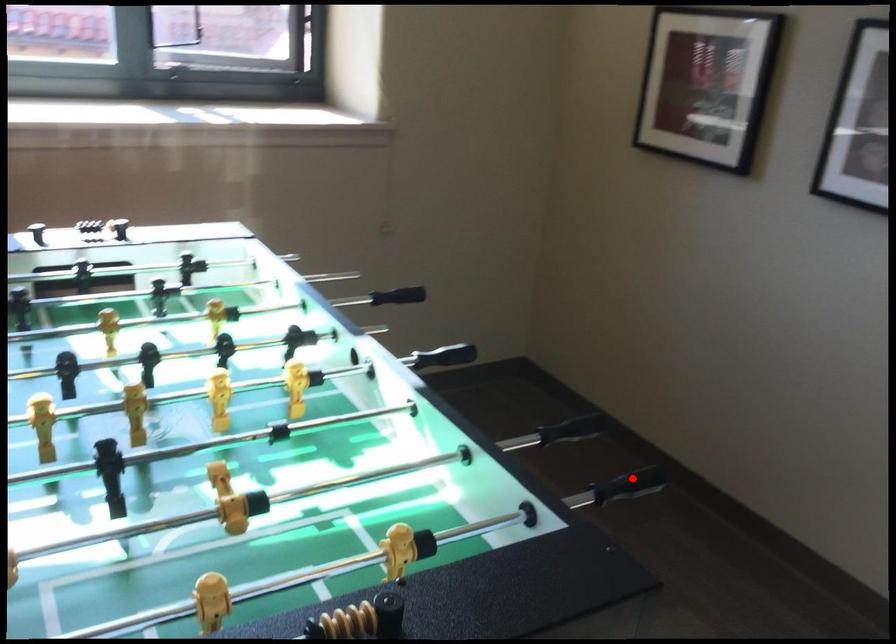
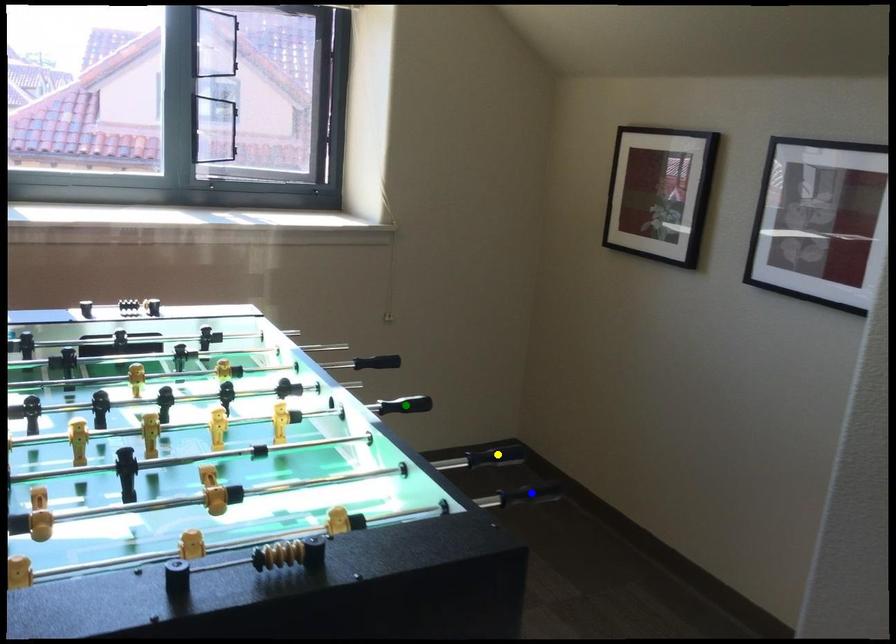
Question: I am providing you with two images of the same scene from different viewpoints. A red point is marked on the first image. You are given multiple points on the second image. Which point in image 2 is actually the same real-world point as the red point in image 1?

Choices:
 (A) yellow point
 (B) green point
 (C) blue point

Answer: (C)